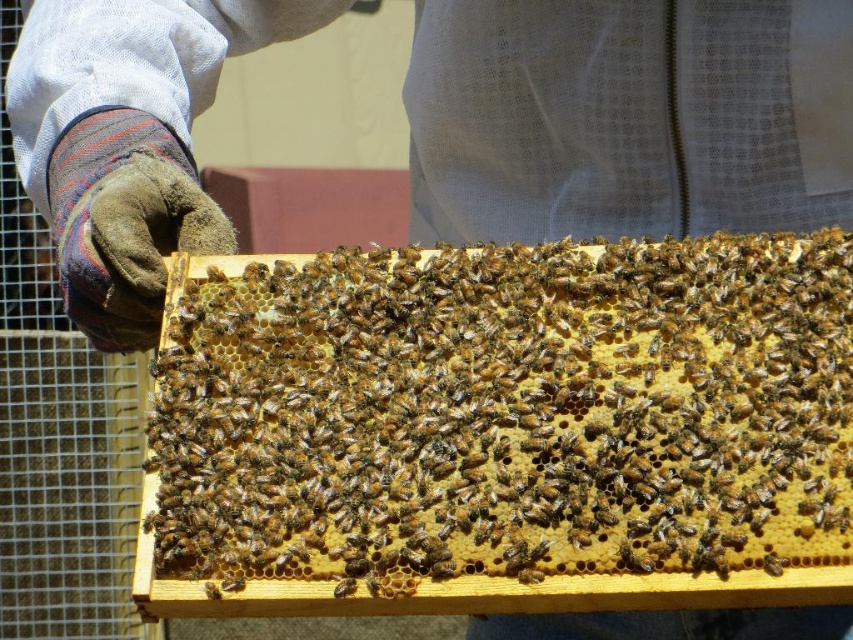
Based on the scene description, where is the brown wooden beehive at center located in terms of its 2D coordinates?

The brown wooden beehive at center is located at the 2D coordinates of point (502, 429).

You are a beekeeper trying to determine if the brown wooden beehive at center can fit inside a storage box designed for the white mesh suit at center. Based on their thickness, will the beehive fit?

The brown wooden beehive at center is thinner than the white mesh suit at center, so it should fit inside the storage box designed for the white mesh suit at center.